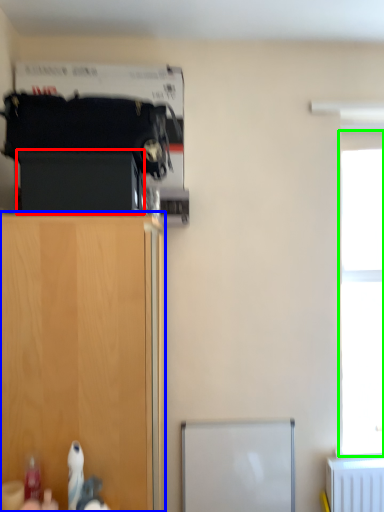
Question: Which object is positioned closest to cabinetry (highlighted by a red box)? Select from cupboard (highlighted by a blue box) and window (highlighted by a green box).

Choices:
 (A) cupboard
 (B) window

Answer: (A)